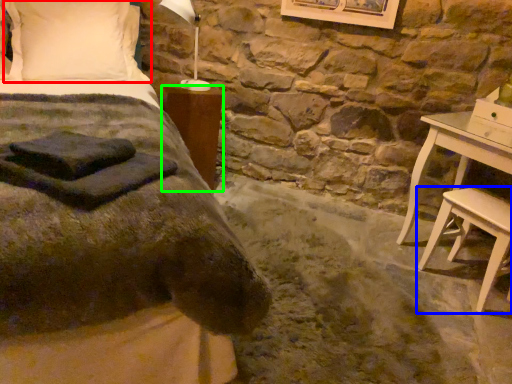
Question: Which is nearer to the pillow (highlighted by a red box)? stool (highlighted by a blue box) or nightstand (highlighted by a green box).

Choices:
 (A) stool
 (B) nightstand

Answer: (B)